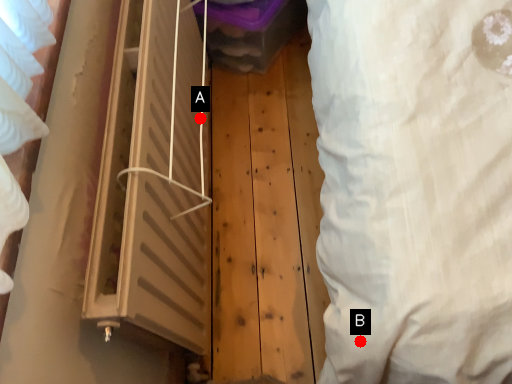
Question: Two points are circled on the image, labeled by A and B beside each circle. Which point is closer to the camera?

Choices:
 (A) A is closer
 (B) B is closer

Answer: (B)